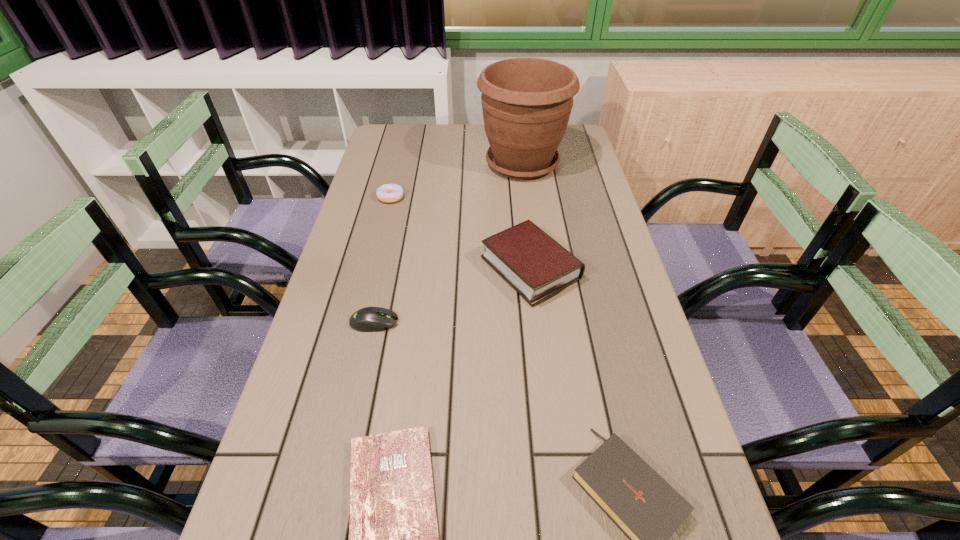
You are a GUI agent. You are given a task and a screenshot of the screen. Output one action in this format:
    pyautogui.click(x=<x>, y=<y>)
    Task: Click on the free space between the flowerpot and the tallest Bible
    This screenshot has height=540, width=960.
    Given the screenshot: What is the action you would take?
    pyautogui.click(x=526, y=216)

Find the location of a particular element. The height and width of the screenshot is (540, 960). vacant point located between the tallest object and the second tallest object is located at coordinates (526, 216).

Identify the location of vacant area between the tallest object and the tallest Bible. [526, 216].

Locate an element on the screen. This screenshot has height=540, width=960. the fourth closest object relative to the tallest object is located at coordinates (648, 510).

The image size is (960, 540). What are the coordinates of `the third closest object to the tallest object` in the screenshot? It's located at (369, 319).

Select which Bible is the second closest to the second farthest object. Please provide its 2D coordinates. Your answer should be formatted as a tuple, i.e. [(x, y)], where the tuple contains the x and y coordinates of a point satisfying the conditions above.

[(393, 533)]

Point out which Bible is positioned as the nearest to the third nearest object. Please provide its 2D coordinates. Your answer should be formatted as a tuple, i.e. [(x, y)], where the tuple contains the x and y coordinates of a point satisfying the conditions above.

[(527, 258)]